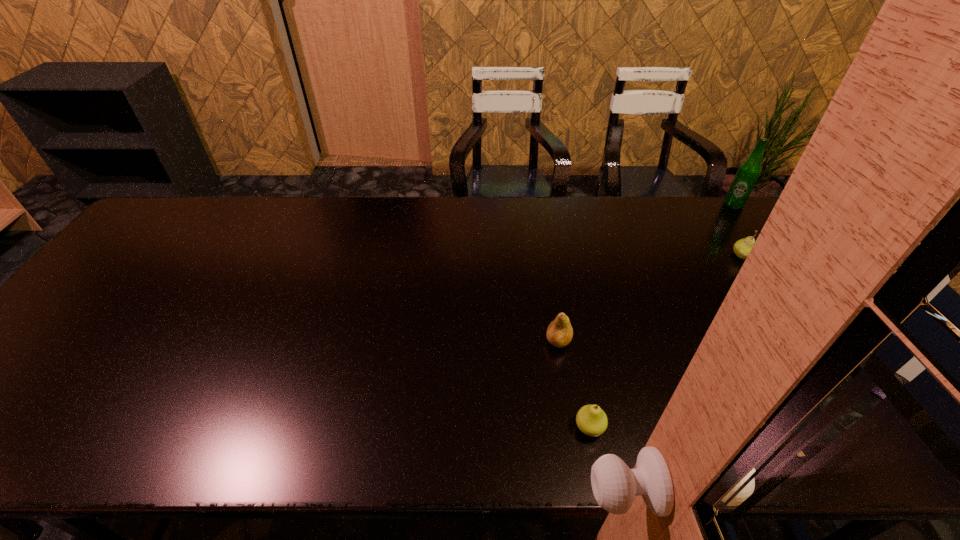
Locate an element on the screen. The height and width of the screenshot is (540, 960). the tallest object is located at coordinates (748, 172).

Find the location of `beer bottle`. beer bottle is located at coordinates (748, 172).

I want to click on the second nearest object, so click(x=559, y=333).

Where is `the rightmost pear`? This screenshot has height=540, width=960. the rightmost pear is located at coordinates (742, 247).

You are a GUI agent. You are given a task and a screenshot of the screen. Output one action in this format:
    pyautogui.click(x=<x>, y=<y>)
    Task: Click on the third object from left to right
    This screenshot has height=540, width=960.
    Given the screenshot: What is the action you would take?
    pyautogui.click(x=742, y=247)

Find the location of `the nearest pear`. the nearest pear is located at coordinates (x=591, y=420).

Identify the location of vacant area located 0.070m on the label of the farthest object. This screenshot has width=960, height=540. (747, 224).

In order to click on free location located on the back of the second nearest pear in this screenshot , I will do `click(550, 291)`.

Where is `vacant space located 0.190m on the left of the third nearest object`? This screenshot has width=960, height=540. vacant space located 0.190m on the left of the third nearest object is located at coordinates (669, 255).

This screenshot has width=960, height=540. Find the location of `vacant space located 0.140m on the back of the nearest object`. vacant space located 0.140m on the back of the nearest object is located at coordinates (577, 360).